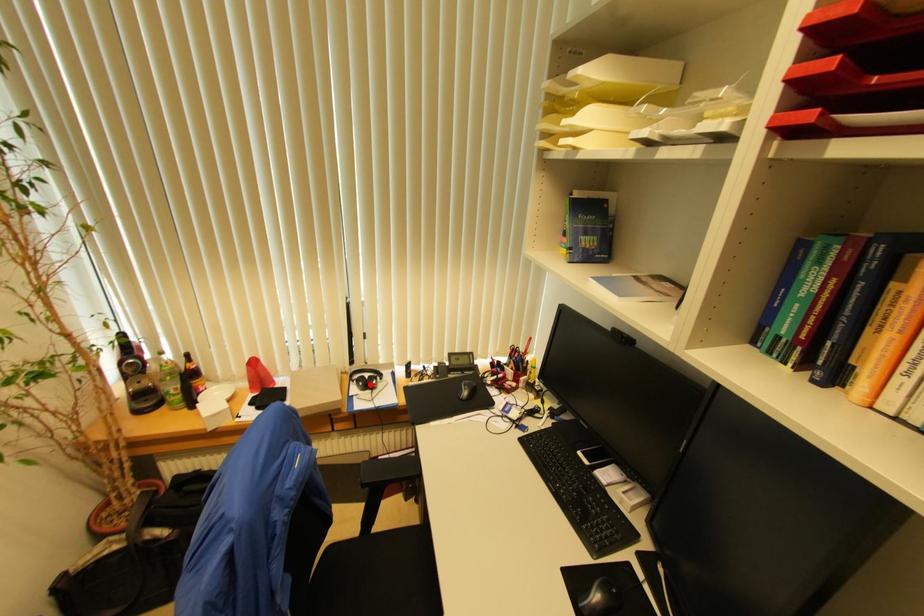
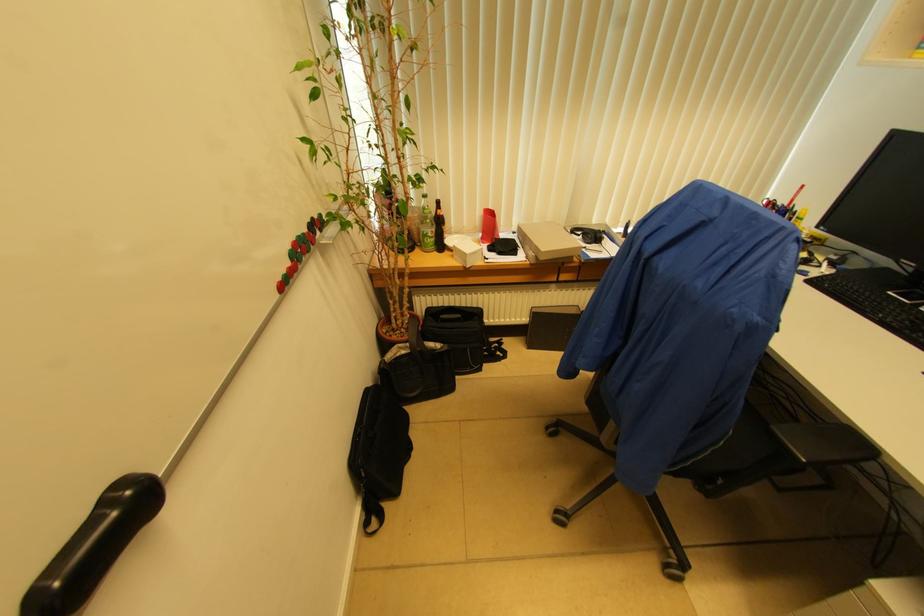
The point at the highlighted location is marked in the first image. Where is the corresponding point in the second image?

(599, 237)